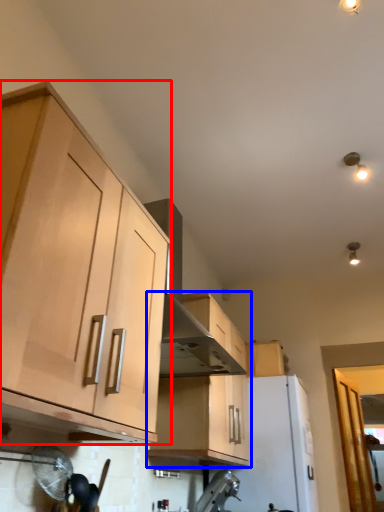
Question: Which object appears farthest to the camera in this image, cabinetry (highlighted by a red box) or cabinetry (highlighted by a blue box)?

Choices:
 (A) cabinetry
 (B) cabinetry

Answer: (B)